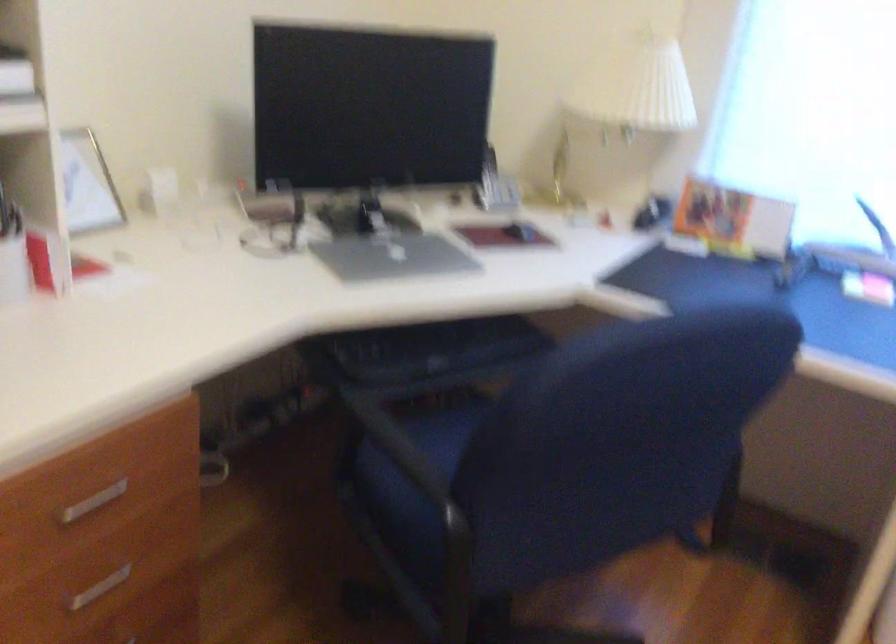
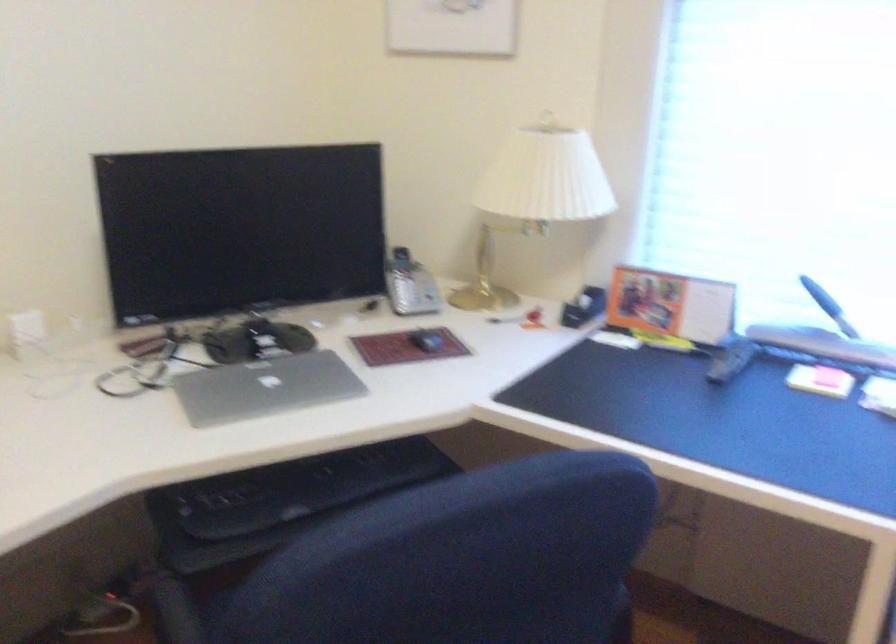
The point at (583, 220) is marked in the first image. Where is the corresponding point in the second image?

(504, 319)